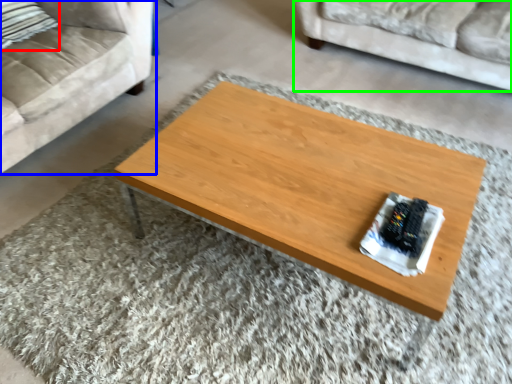
Question: Considering the real-world distances, which object is closest to pillow (highlighted by a red box)? studio couch (highlighted by a blue box) or studio couch (highlighted by a green box).

Choices:
 (A) studio couch
 (B) studio couch

Answer: (A)